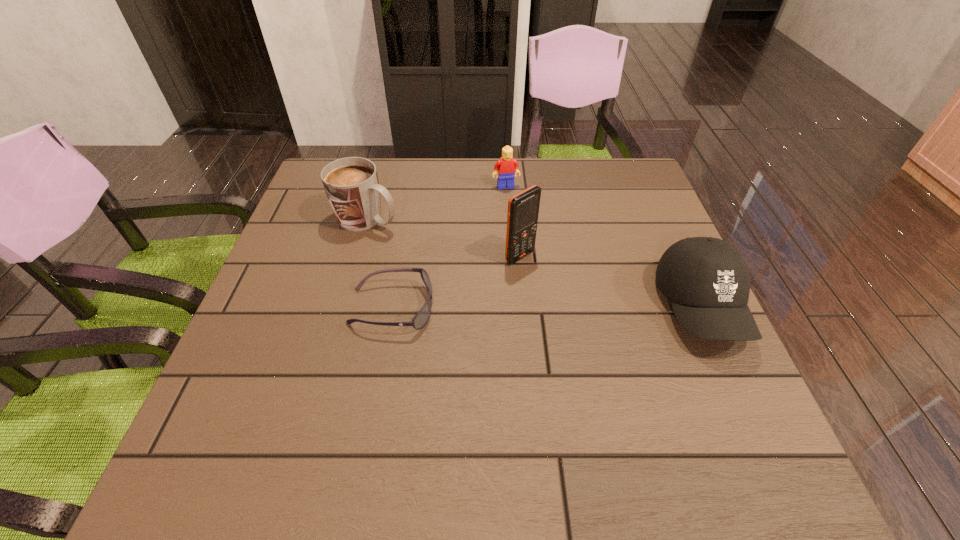
What are the coordinates of `free space located 0.100m on the screen of the cellular telephone` in the screenshot? It's located at (563, 288).

Identify the location of vacant space located 0.110m on the screen of the cellular telephone. The height and width of the screenshot is (540, 960). (565, 291).

Locate an element on the screen. This screenshot has height=540, width=960. free spot located 0.360m on the screen of the cellular telephone is located at coordinates (664, 364).

Where is `free space located on the face of the Lego`? Image resolution: width=960 pixels, height=540 pixels. free space located on the face of the Lego is located at coordinates (532, 269).

Image resolution: width=960 pixels, height=540 pixels. In order to click on free region located 0.110m on the face of the Lego in this screenshot , I will do `click(515, 213)`.

I want to click on vacant space located on the face of the Lego, so click(x=525, y=246).

The width and height of the screenshot is (960, 540). What are the coordinates of `mug positioned at the far edge` in the screenshot? It's located at (351, 184).

At what (x,y) coordinates should I click in order to perform the action: click on Lego at the far edge. Please return your answer as a coordinate pair (x, y). Looking at the image, I should click on (507, 167).

The image size is (960, 540). I want to click on object that is at the left edge, so click(351, 184).

This screenshot has height=540, width=960. Identify the location of object that is at the right edge. (707, 280).